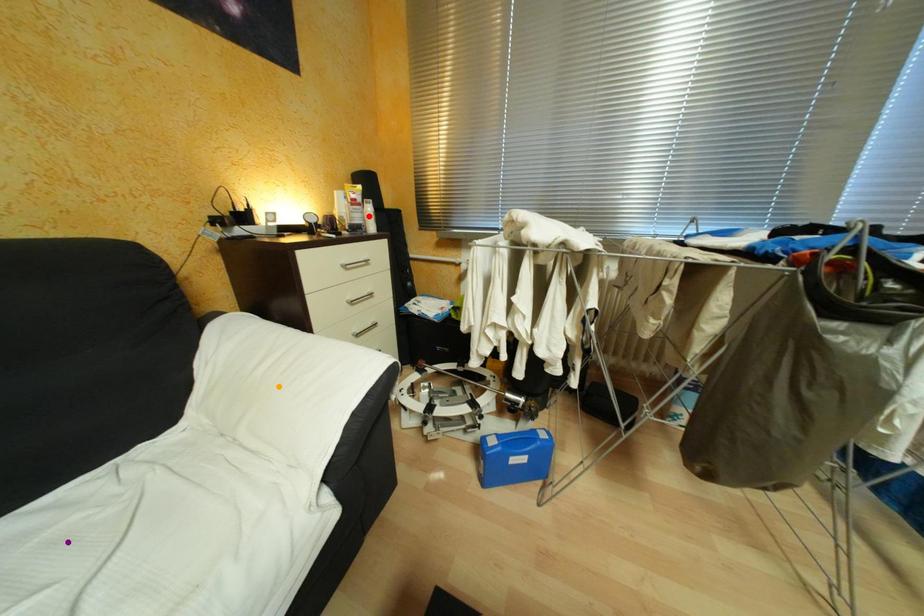
Order these from nearest to farthest:
- red point
- purple point
- orange point

purple point < orange point < red point